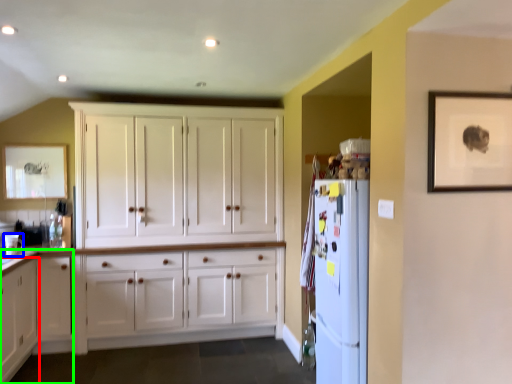
Question: Which is farther away from cabinetry (highlighted by a red box)? appliance (highlighted by a blue box) or dresser (highlighted by a green box)?

Choices:
 (A) appliance
 (B) dresser

Answer: (A)